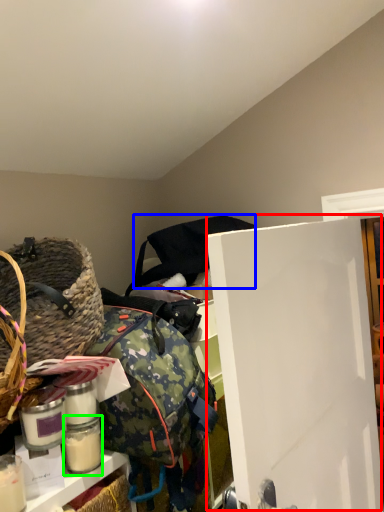
Question: Which object is the farthest from door (highlighted by a red box)? Choose among these: bag (highlighted by a blue box) or glass jar (highlighted by a green box).

Choices:
 (A) bag
 (B) glass jar

Answer: (B)